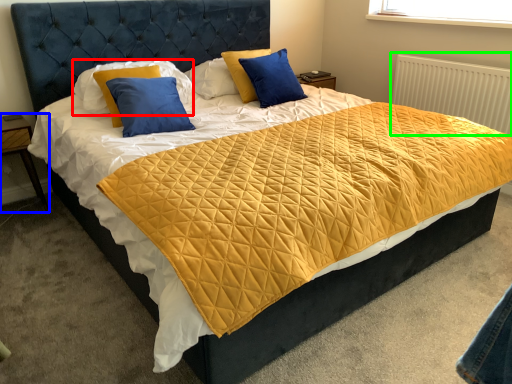
Question: Estimate the real-world distances between objects in this image. Which object is farther from pillow (highlighted by a red box), nightstand (highlighted by a blue box) or radiator (highlighted by a green box)?

Choices:
 (A) nightstand
 (B) radiator

Answer: (B)